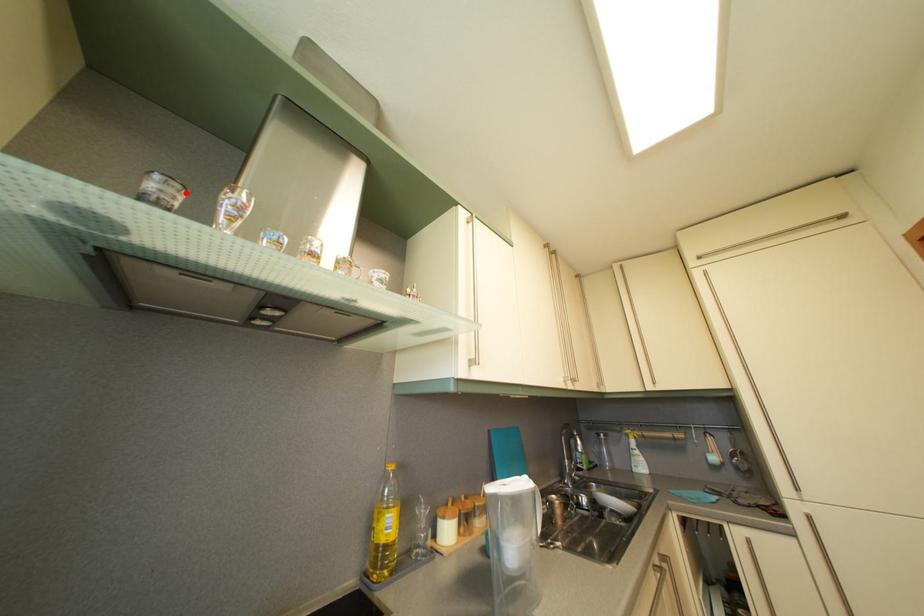
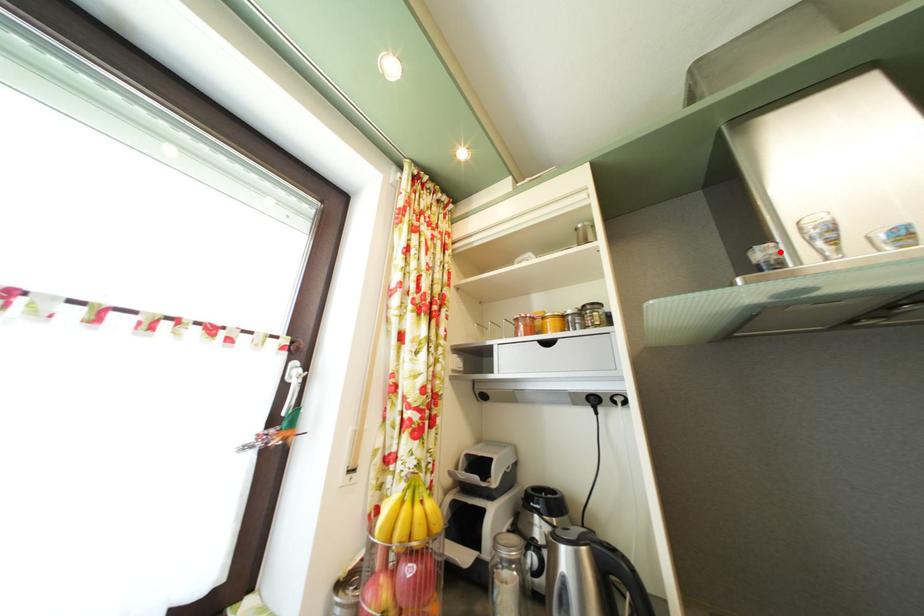
I am providing you with two images of the same scene from different viewpoints. A red point is marked on the first image and another point is marked on the second image. Is the marked point in image1 the same physical position as the marked point in image2?

Yes